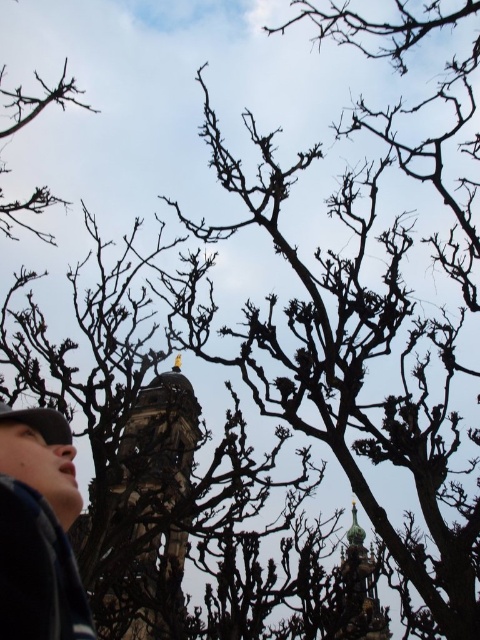
Does dark blue jacket at lower left appear over green glazed tower at center?

Yes, dark blue jacket at lower left is above green glazed tower at center.

Is dark blue jacket at lower left to the right of green glazed tower at center from the viewer's perspective?

Incorrect, dark blue jacket at lower left is not on the right side of green glazed tower at center.

What do you see at coordinates (38, 529) in the screenshot? The image size is (480, 640). I see `dark blue jacket at lower left` at bounding box center [38, 529].

You are a GUI agent. You are given a task and a screenshot of the screen. Output one action in this format:
    pyautogui.click(x=<x>, y=<y>)
    Task: Click on the dark blue jacket at lower left
    The width and height of the screenshot is (480, 640).
    Given the screenshot: What is the action you would take?
    pyautogui.click(x=38, y=529)

Is stone tower at center smaller than green glazed tower at center?

Indeed, stone tower at center has a smaller size compared to green glazed tower at center.

Does stone tower at center have a lesser width compared to green glazed tower at center?

Correct, stone tower at center's width is less than green glazed tower at center's.

Does point (88, 531) come behind point (342, 563)?

No, (88, 531) is closer to viewer.

Locate an element on the screen. stone tower at center is located at coordinates (147, 513).

Does stone tower at center have a lesser height compared to dark blue jacket at lower left?

No, stone tower at center is not shorter than dark blue jacket at lower left.

Is stone tower at center smaller than dark blue jacket at lower left?

Incorrect, stone tower at center is not smaller in size than dark blue jacket at lower left.

Is point (172, 532) positioned before point (44, 564)?

No, it is not.

Where is `stone tower at center`? Image resolution: width=480 pixels, height=640 pixels. stone tower at center is located at coordinates (147, 513).